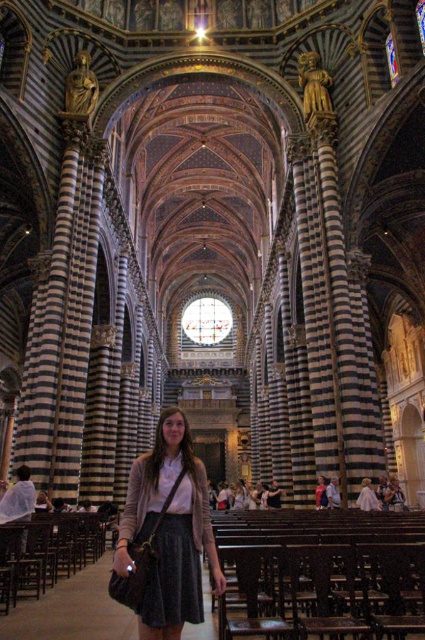
Question: Which of the following is the closest to the observer?

Choices:
 (A) matte black skirt at center
 (B) matte white dress at center

Answer: (A)

Question: Does matte black skirt at center have a larger size compared to matte white dress at center?

Choices:
 (A) yes
 (B) no

Answer: (A)

Question: Is matte black skirt at center positioned behind matte white dress at center?

Choices:
 (A) yes
 (B) no

Answer: (B)

Question: Can you confirm if matte black skirt at center is positioned to the right of matte white dress at center?

Choices:
 (A) no
 (B) yes

Answer: (A)